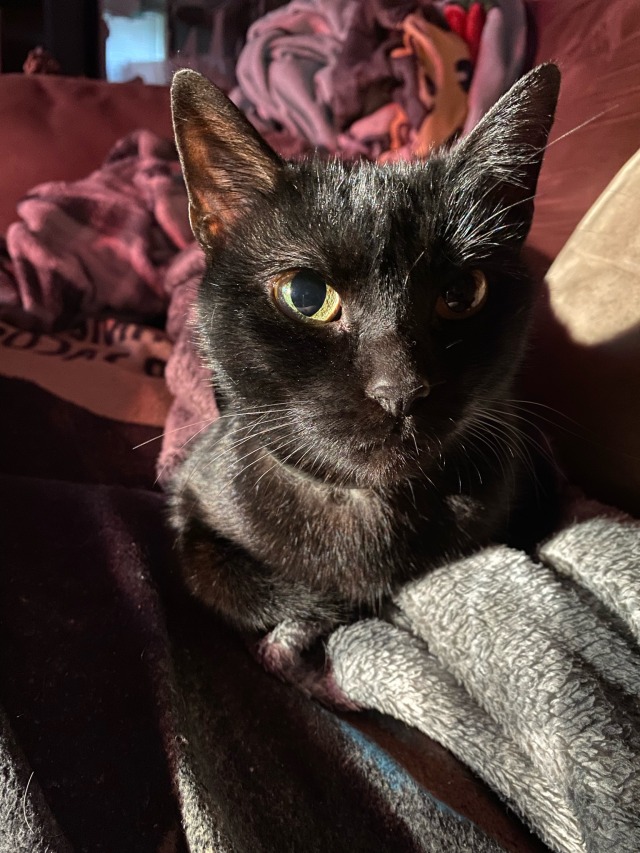
Locate an element on the screen. The height and width of the screenshot is (853, 640). chest is located at coordinates (362, 559).